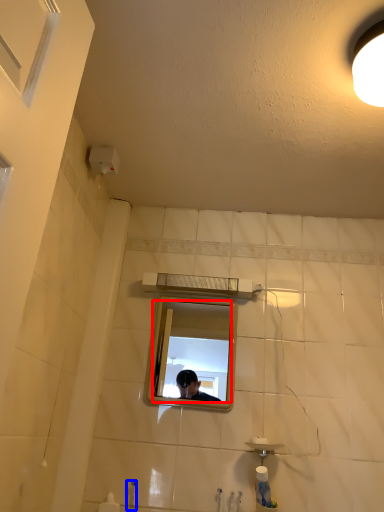
Question: Which point is closer to the camera, mirror (highlighted by a red box) or faucet (highlighted by a blue box)?

Choices:
 (A) mirror
 (B) faucet

Answer: (B)